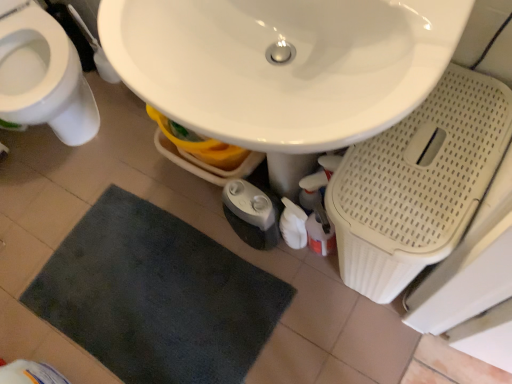
At what (x,y) coordinates should I click in order to perform the action: click on empty space that is ontop of dark gray plush bath mat at lower center (from a real-world perspective). Please return your answer as a coordinate pair (x, y). Looking at the image, I should click on (154, 299).